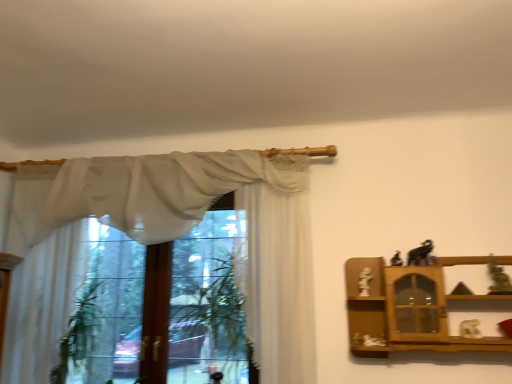
Describe the element at coordinates (276, 268) in the screenshot. I see `white sheer curtain at center, placed as the third curtain when sorted from left to right` at that location.

Image resolution: width=512 pixels, height=384 pixels. Describe the element at coordinates (498, 279) in the screenshot. I see `matte gray statue at right, the 1th toy when ordered from right to left` at that location.

This screenshot has width=512, height=384. Describe the element at coordinates (42, 304) in the screenshot. I see `white sheer curtain at left, which ranks as the first curtain in left-to-right order` at that location.

What do you see at coordinates (139, 192) in the screenshot? I see `sheer white curtain at upper left, which is the second curtain from right to left` at bounding box center [139, 192].

The image size is (512, 384). Describe the element at coordinates (365, 282) in the screenshot. I see `white matte statue at right, which is counted as the 1th toy, starting from the left` at that location.

What do you see at coordinates (420, 254) in the screenshot? I see `matte black elephant at upper right, positioned as the 3th toy in left-to-right order` at bounding box center [420, 254].

What is the approximate width of matte black elephant at upper right, positioned as the 3th toy in left-to-right order?

The width of matte black elephant at upper right, positioned as the 3th toy in left-to-right order, is 13.39 centimeters.

In order to click on wooden cabinet at right in this screenshot , I will do [x=411, y=308].

In order to click on white sheer curtain at center, placed as the third curtain when sorted from left to right in this screenshot , I will do `click(276, 268)`.

From a real-world perspective, is matte black elephant at upper right, which is the 2th toy in left-to-right order, positioned above or below matte gray statue at right, the 1th toy when ordered from right to left?

Clearly, from a real-world perspective, matte black elephant at upper right, which is the 2th toy in left-to-right order, is above matte gray statue at right, the 1th toy when ordered from right to left.

Does point (401, 262) come closer to viewer compared to point (489, 257)?

No, (401, 262) is behind (489, 257).

Is the surface of matte black elephant at upper right, which is the 2th toy in left-to-right order, in direct contact with matte gray statue at right, which ranks as the 5th toy in left-to-right order?

No, matte black elephant at upper right, which is the 2th toy in left-to-right order, is not with matte gray statue at right, which ranks as the 5th toy in left-to-right order.

Does matte black elephant at upper right, which is the 2th toy in left-to-right order, have a greater width compared to matte gray statue at right, the 1th toy when ordered from right to left?

In fact, matte black elephant at upper right, which is the 2th toy in left-to-right order, might be narrower than matte gray statue at right, the 1th toy when ordered from right to left.

Is matte black elephant at upper right, arranged as the 3th toy when viewed from the right, spatially inside white matte statue at right, which is counted as the 1th toy, starting from the left, or outside of it?

matte black elephant at upper right, arranged as the 3th toy when viewed from the right, cannot be found inside white matte statue at right, which is counted as the 1th toy, starting from the left.

Is point (414, 254) more distant than point (366, 283)?

Yes, it is behind point (366, 283).

Does matte black elephant at upper right, arranged as the 3th toy when viewed from the right, have a lesser height compared to white matte statue at right, which is counted as the 1th toy, starting from the left?

Yes.

Looking at this image, can you confirm if matte black elephant at upper right, arranged as the 3th toy when viewed from the right, is smaller than white matte statue at right, which is counted as the 1th toy, starting from the left?

No, matte black elephant at upper right, arranged as the 3th toy when viewed from the right, is not smaller than white matte statue at right, which is counted as the 1th toy, starting from the left.

From the image's perspective, between white matte statue at right, which is counted as the 1th toy, starting from the left, and white sheer curtain at left, which ranks as the first curtain in left-to-right order, which one is located above?

white sheer curtain at left, which ranks as the first curtain in left-to-right order, is shown above in the image.

Considering the relative positions of white matte statue at right, which is counted as the 1th toy, starting from the left, and white sheer curtain at left, which ranks as the first curtain in left-to-right order, in the image provided, is white matte statue at right, which is counted as the 1th toy, starting from the left, to the left or to the right of white sheer curtain at left, which ranks as the first curtain in left-to-right order,?

From the image, it's evident that white matte statue at right, which is counted as the 1th toy, starting from the left, is to the right of white sheer curtain at left, which ranks as the first curtain in left-to-right order.

Could you tell me if white matte statue at right, which is counted as the 1th toy, starting from the left, is facing white sheer curtain at left, acting as the third curtain starting from the right?

No.

Can you tell me how much white matte statue at right, which is counted as the 1th toy, starting from the left, and white sheer curtain at left, which ranks as the first curtain in left-to-right order, differ in facing direction?

The facing directions of white matte statue at right, which is counted as the 1th toy, starting from the left, and white sheer curtain at left, which ranks as the first curtain in left-to-right order, are 1.32 degrees apart.

Which object is further away from the camera, wooden cabinet at right or matte gray statue at right, which ranks as the 5th toy in left-to-right order?

matte gray statue at right, which ranks as the 5th toy in left-to-right order, is more distant.

Do you think wooden cabinet at right is within matte gray statue at right, which ranks as the 5th toy in left-to-right order, or outside of it?

wooden cabinet at right is outside matte gray statue at right, which ranks as the 5th toy in left-to-right order.

From a real-world perspective, between wooden cabinet at right and matte gray statue at right, the 1th toy when ordered from right to left, who is vertically higher?

matte gray statue at right, the 1th toy when ordered from right to left, is physically above.

Considering the relative positions of matte gray statue at right, which ranks as the 5th toy in left-to-right order, and green leafy plant at center in the image provided, is matte gray statue at right, which ranks as the 5th toy in left-to-right order, to the left of green leafy plant at center from the viewer's perspective?

In fact, matte gray statue at right, which ranks as the 5th toy in left-to-right order, is to the right of green leafy plant at center.

Identify the location of the 2nd toy above the green leafy plant at center (from a real-world perspective). (498, 279).

Measure the distance between matte gray statue at right, the 1th toy when ordered from right to left, and green leafy plant at center.

A distance of 5.07 feet exists between matte gray statue at right, the 1th toy when ordered from right to left, and green leafy plant at center.

Consider the image. From the image's perspective, which object appears higher, matte gray statue at right, which ranks as the 5th toy in left-to-right order, or green leafy plant at center?

matte gray statue at right, which ranks as the 5th toy in left-to-right order, from the image's perspective.

Between white sheer curtain at center, which is counted as the 1th curtain, starting from the right, and sheer white curtain at upper left, which is the second curtain from right to left, which one appears on the left side from the viewer's perspective?

sheer white curtain at upper left, which is the second curtain from right to left.

Does white sheer curtain at center, which is counted as the 1th curtain, starting from the right, lie behind sheer white curtain at upper left, which is the second curtain from right to left?

No, it is not.

Which of these two, white sheer curtain at center, which is counted as the 1th curtain, starting from the right, or sheer white curtain at upper left, which is the second curtain from right to left, is smaller?

With smaller size is white sheer curtain at center, which is counted as the 1th curtain, starting from the right.

Is white sheer curtain at center, which is counted as the 1th curtain, starting from the right, far from sheer white curtain at upper left, which is the second curtain from right to left?

No, there isn't a large distance between white sheer curtain at center, which is counted as the 1th curtain, starting from the right, and sheer white curtain at upper left, which is the second curtain from right to left.

From the image's perspective, count 2nd curtains downward from the sheer white curtain at upper left, which is the 2th curtain in left-to-right order, and point to it. Please provide its 2D coordinates.

[(42, 304)]

Could you tell me if sheer white curtain at upper left, which is the 2th curtain in left-to-right order, is turned towards white sheer curtain at left, which ranks as the first curtain in left-to-right order?

Yes, sheer white curtain at upper left, which is the 2th curtain in left-to-right order, faces towards white sheer curtain at left, which ranks as the first curtain in left-to-right order.

Is sheer white curtain at upper left, which is the 2th curtain in left-to-right order, behind white sheer curtain at left, acting as the third curtain starting from the right?

No, it is not.

Does sheer white curtain at upper left, which is the 2th curtain in left-to-right order, have a lesser width compared to white sheer curtain at left, which ranks as the first curtain in left-to-right order?

Correct, the width of sheer white curtain at upper left, which is the 2th curtain in left-to-right order, is less than that of white sheer curtain at left, which ranks as the first curtain in left-to-right order.

You are a GUI agent. You are given a task and a screenshot of the screen. Output one action in this format:
    pyautogui.click(x=<x>, y=<y>)
    Task: Click on the toy that is the 1st object directly below the matte black elephant at upper right, the fourth toy in the right-to-left sequence (from a real-world perspective)
    Image resolution: width=512 pixels, height=384 pixels.
    Given the screenshot: What is the action you would take?
    pyautogui.click(x=498, y=279)

You are a GUI agent. You are given a task and a screenshot of the screen. Output one action in this format:
    pyautogui.click(x=<x>, y=<y>)
    Task: Click on the toy that is the 2nd object located in front of the white matte statue at right, which is counted as the 1th toy, starting from the left
    This screenshot has width=512, height=384.
    Given the screenshot: What is the action you would take?
    pyautogui.click(x=420, y=254)

Looking at the image, which one is located closer to green leafy plant at center, matte black elephant at upper right, which is the 2th toy in left-to-right order, or white sheer curtain at center, which is counted as the 1th curtain, starting from the right?

The object closer to green leafy plant at center is white sheer curtain at center, which is counted as the 1th curtain, starting from the right.

From the image, which object appears to be farther from wooden cabinet at right, sheer white curtain at upper left, which is the 2th curtain in left-to-right order, or matte black elephant at upper right, positioned as the 3th toy in left-to-right order?

sheer white curtain at upper left, which is the 2th curtain in left-to-right order, is positioned further to the anchor wooden cabinet at right.

Which object lies further to the anchor point matte black elephant at upper right, arranged as the 3th toy when viewed from the right, wooden cabinet at right or sheer white curtain at upper left, which is the second curtain from right to left?

The object further to matte black elephant at upper right, arranged as the 3th toy when viewed from the right, is sheer white curtain at upper left, which is the second curtain from right to left.

Looking at this image, looking at the image, which one is located closer to matte gray statue at right, which ranks as the 5th toy in left-to-right order, matte black elephant at upper right, arranged as the 3th toy when viewed from the right, or white sheer curtain at left, acting as the third curtain starting from the right?

matte black elephant at upper right, arranged as the 3th toy when viewed from the right, is positioned closer to the anchor matte gray statue at right, which ranks as the 5th toy in left-to-right order.

Based on their spatial positions, is matte black elephant at upper right, positioned as the 3th toy in left-to-right order, or matte gray statue at right, the 1th toy when ordered from right to left, closer to white sheer curtain at left, which ranks as the first curtain in left-to-right order?

matte black elephant at upper right, positioned as the 3th toy in left-to-right order.

Considering their positions, is sheer white curtain at upper left, which is the second curtain from right to left, positioned closer to matte black elephant at upper right, the fourth toy in the right-to-left sequence, than matte black elephant at upper right, arranged as the 3th toy when viewed from the right?

The object closer to matte black elephant at upper right, the fourth toy in the right-to-left sequence, is matte black elephant at upper right, arranged as the 3th toy when viewed from the right.

Considering their positions, is white matte statue at right, which is counted as the 1th toy, starting from the left, positioned further to white matte elephant at right, acting as the second toy starting from the right, than matte black elephant at upper right, positioned as the 3th toy in left-to-right order?

white matte statue at right, which is counted as the 1th toy, starting from the left.

Estimate the real-world distances between objects in this image. Which object is closer to white matte statue at right, which is counted as the 1th toy, starting from the left, matte black elephant at upper right, the fourth toy in the right-to-left sequence, or green leafy plant at center?

matte black elephant at upper right, the fourth toy in the right-to-left sequence, is closer to white matte statue at right, which is counted as the 1th toy, starting from the left.

Identify the location of plant between sheer white curtain at upper left, which is the second curtain from right to left, and white matte statue at right, which is counted as the 1th toy, starting from the left, from left to right. (210, 313).

You are a GUI agent. You are given a task and a screenshot of the screen. Output one action in this format:
    pyautogui.click(x=<x>, y=<y>)
    Task: Click on the plant situated between white sheer curtain at left, which ranks as the first curtain in left-to-right order, and matte black elephant at upper right, arranged as the 3th toy when viewed from the right, from left to right
    This screenshot has width=512, height=384.
    Given the screenshot: What is the action you would take?
    pyautogui.click(x=210, y=313)

Where is `curtain situated between sheer white curtain at upper left, which is the 2th curtain in left-to-right order, and matte black elephant at upper right, the fourth toy in the right-to-left sequence, from left to right`? This screenshot has width=512, height=384. curtain situated between sheer white curtain at upper left, which is the 2th curtain in left-to-right order, and matte black elephant at upper right, the fourth toy in the right-to-left sequence, from left to right is located at coordinates (276, 268).

Where is `toy between white sheer curtain at left, acting as the third curtain starting from the right, and matte black elephant at upper right, which is the 2th toy in left-to-right order`? This screenshot has height=384, width=512. toy between white sheer curtain at left, acting as the third curtain starting from the right, and matte black elephant at upper right, which is the 2th toy in left-to-right order is located at coordinates (365, 282).